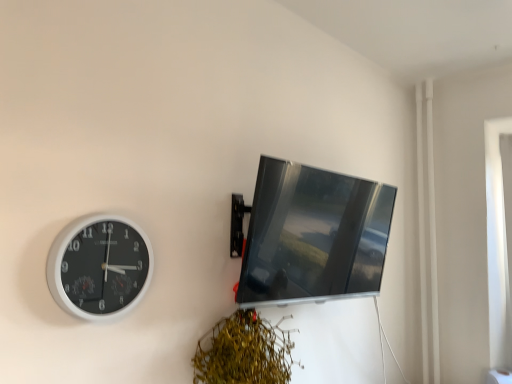
Question: In terms of height, does white plastic clock at left look taller or shorter compared to matte black monitor at upper right?

Choices:
 (A) tall
 (B) short

Answer: (B)

Question: Is white plastic clock at left in front of or behind matte black monitor at upper right in the image?

Choices:
 (A) front
 (B) behind

Answer: (A)

Question: Estimate the real-world distances between objects in this image. Which object is farther from the matte black monitor at upper right?

Choices:
 (A) green leafy plant at lower center
 (B) white plastic clock at left

Answer: (B)

Question: Estimate the real-world distances between objects in this image. Which object is closer to the white plastic clock at left?

Choices:
 (A) matte black monitor at upper right
 (B) green leafy plant at lower center

Answer: (B)